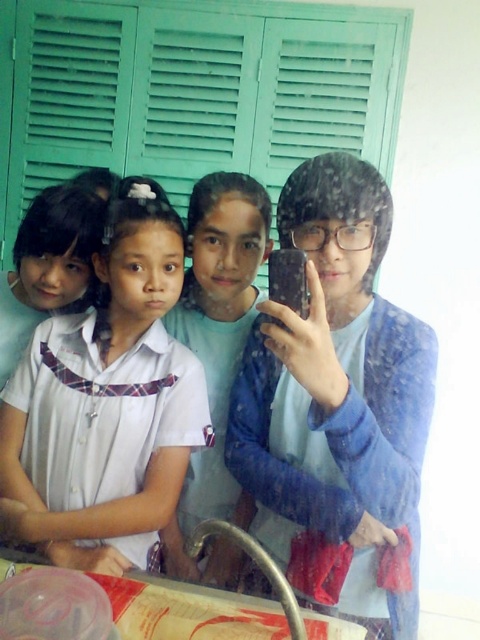
Can you confirm if white fabric shirt at center is shorter than matte blue shirt at center?

Correct, white fabric shirt at center is not as tall as matte blue shirt at center.

Between point (100, 531) and point (187, 307), which one is positioned behind?

The point (187, 307) is more distant.

Identify the location of white fabric shirt at center. (107, 403).

Who is shorter, blue fabric shirt at center or white fabric shirt at center?

With less height is white fabric shirt at center.

Does blue fabric shirt at center have a greater height compared to white fabric shirt at center?

Yes, blue fabric shirt at center is taller than white fabric shirt at center.

The image size is (480, 640). In order to click on blue fabric shirt at center in this screenshot , I will do `click(337, 408)`.

Who is shorter, blue fabric shirt at center or matte blue shirt at center?

blue fabric shirt at center is shorter.

Is point (265, 513) closer to viewer compared to point (213, 275)?

Yes.

This screenshot has height=640, width=480. Identify the location of blue fabric shirt at center. (337, 408).